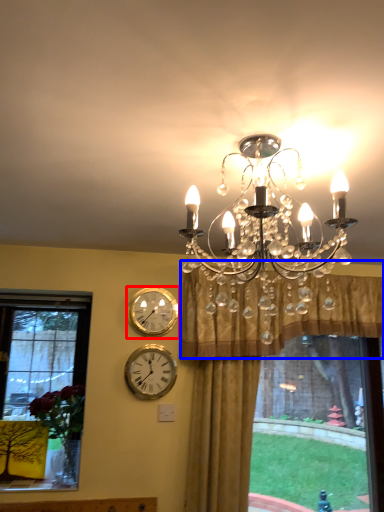
Question: Which of the following is the closest to the observer, wall clock (highlighted by a red box) or curtain (highlighted by a blue box)?

Choices:
 (A) wall clock
 (B) curtain

Answer: (B)